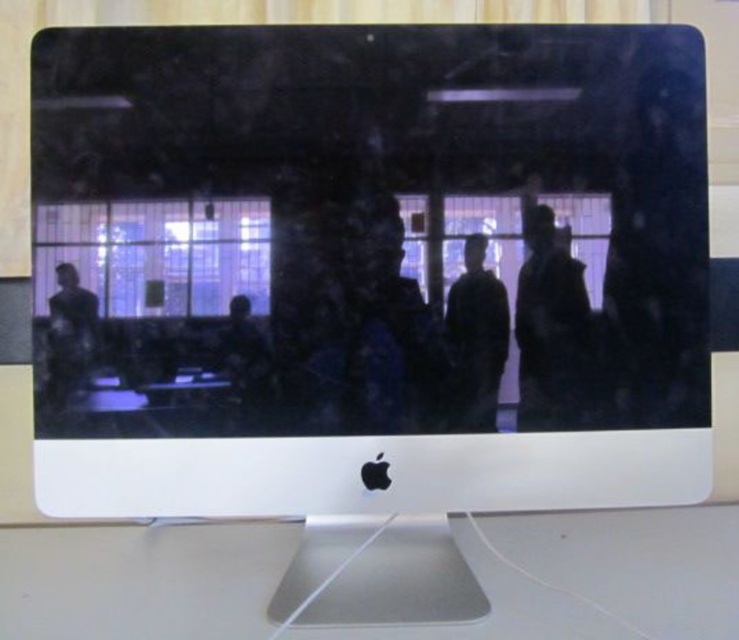
In the scene shown: You are setting up a new computer workstation. You have a silver metallic computer desk at center and a dark fabric jacket at right. Where should you place the jacket to avoid blocking the monitor?

The dark fabric jacket at right should be placed above the silver metallic computer desk at center since the desk is located below the jacket, allowing the jacket to be positioned in a non obstructive area above the desk.

You are a fashion designer observing the reflection on the iMac screen. You notice two jackets displayed in the reflection. Which jacket, the dark fabric jacket at right or the black matte jacket at center, appears taller in the warped reflection?

The dark fabric jacket at right appears much taller than the black matte jacket at center in the warped reflection due to the screen curvature distortion.

You are sitting at the silver metallic computer desk at center and want to reach the dark fabric jacket at right. Which direction should you move to get closer to the jacket?

The silver metallic computer desk at center is to the left of dark fabric jacket at right, so you should move to your right to get closer to the jacket.